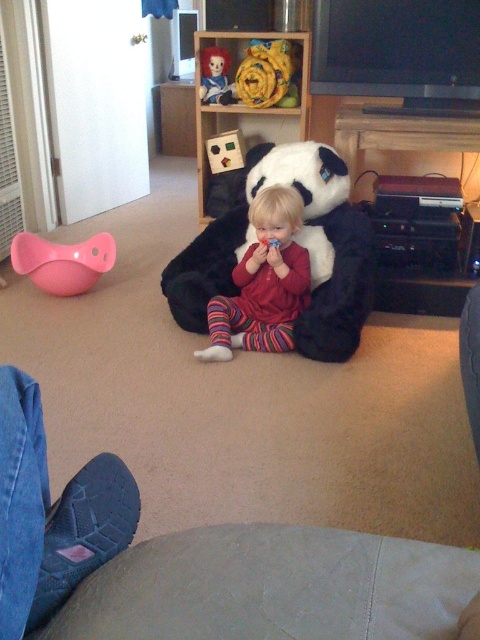
Question: Which point is farther from the camera taking this photo?

Choices:
 (A) (213, 92)
 (B) (285, 99)
 (C) (308, 262)

Answer: (A)

Question: Which point is closer to the camera taking this photo?

Choices:
 (A) (253, 60)
 (B) (322, 182)
 (C) (69, 275)
 (D) (212, 317)

Answer: (B)

Question: Can you confirm if striped fleece pajamas at center is positioned below smooth plastic doll at upper center?

Choices:
 (A) yes
 (B) no

Answer: (A)

Question: Can you confirm if striped fleece pajamas at center is smaller than fluffy yellow fabric at upper center?

Choices:
 (A) yes
 (B) no

Answer: (B)

Question: Which point is closer to the camera taking this photo?

Choices:
 (A) (14, 260)
 (B) (224, 56)

Answer: (A)

Question: Can you confirm if striped fleece pajamas at center is smaller than fluffy yellow fabric at upper center?

Choices:
 (A) yes
 (B) no

Answer: (B)